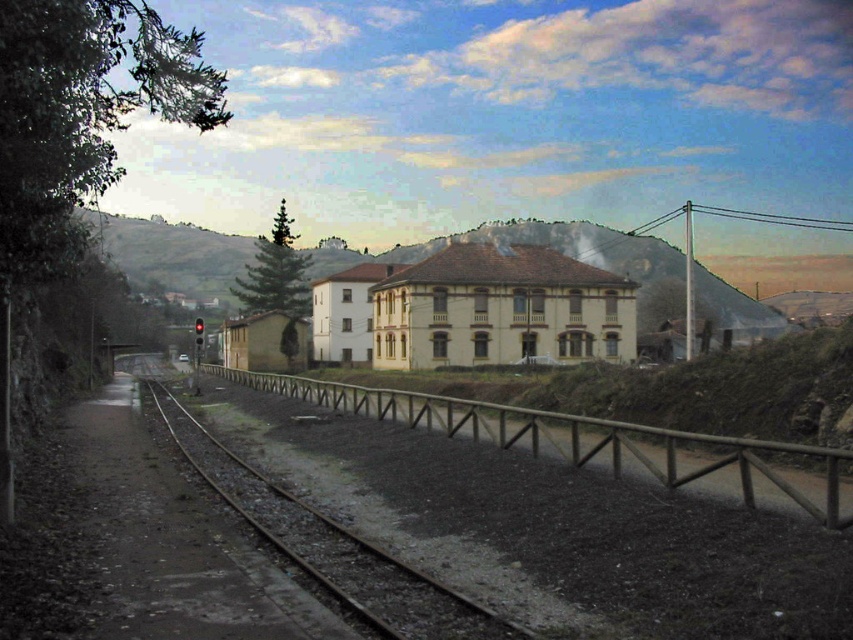
Which of these two, brown wooden rail at center or brown wooden track at center, stands shorter?

brown wooden track at center

Is brown wooden rail at center behind brown wooden track at center?

Yes, it is.

Between point (576, 451) and point (291, 506), which one is positioned in front?

Point (576, 451) is more forward.

Locate an element on the screen. brown wooden rail at center is located at coordinates (595, 442).